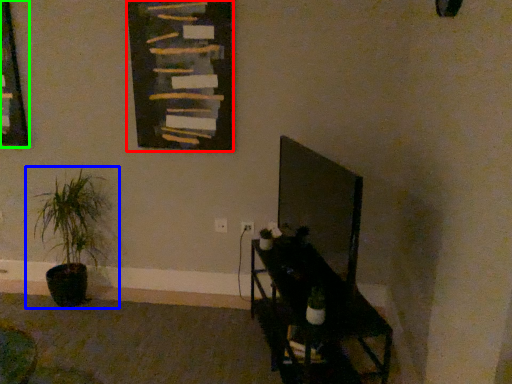
Question: Estimate the real-world distances between objects in this image. Which object is farther from bulletin board (highlighted by a red box), houseplant (highlighted by a blue box) or picture frame (highlighted by a green box)?

Choices:
 (A) houseplant
 (B) picture frame

Answer: (B)